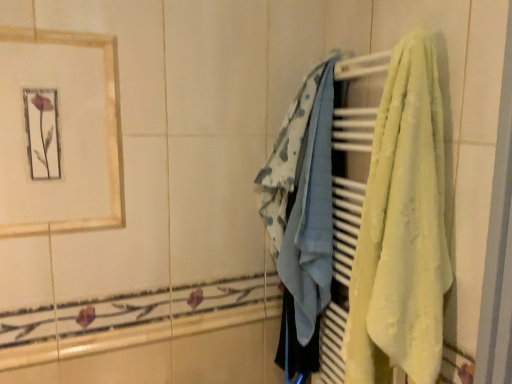
Question: Would you say gold-framed picture at upper left is to the left or to the right of light blue fabric at center, which is the second towel from right to left, in the picture?

Choices:
 (A) left
 (B) right

Answer: (A)

Question: From a real-world perspective, is gold-framed picture at upper left above or below light blue fabric at center, which is the second towel from right to left?

Choices:
 (A) above
 (B) below

Answer: (A)

Question: Based on their relative distances, which object is farther from the yellow soft towel at right, which is counted as the second towel, starting from the left?

Choices:
 (A) light blue fabric at center, positioned as the 1th towel in left-to-right order
 (B) gold-framed picture at upper left

Answer: (B)

Question: Based on their relative distances, which object is farther from the yellow soft towel at right, which is counted as the second towel, starting from the left?

Choices:
 (A) light blue fabric at center, positioned as the 1th towel in left-to-right order
 (B) gold-framed picture at upper left

Answer: (B)